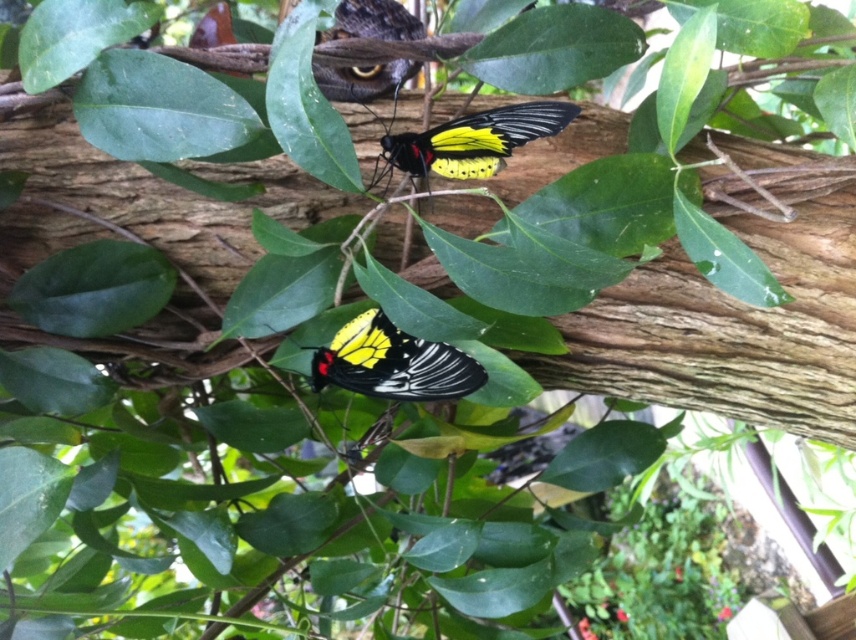
Is yellow-black glossy butterfly at center to the right of yellow-black winged butterfly at center from the viewer's perspective?

In fact, yellow-black glossy butterfly at center is to the left of yellow-black winged butterfly at center.

Who is lower down, yellow-black glossy butterfly at center or yellow-black winged butterfly at center?

yellow-black glossy butterfly at center is lower down.

Describe the element at coordinates (391, 362) in the screenshot. I see `yellow-black glossy butterfly at center` at that location.

Locate an element on the screen. The width and height of the screenshot is (856, 640). yellow-black glossy butterfly at center is located at coordinates (391, 362).